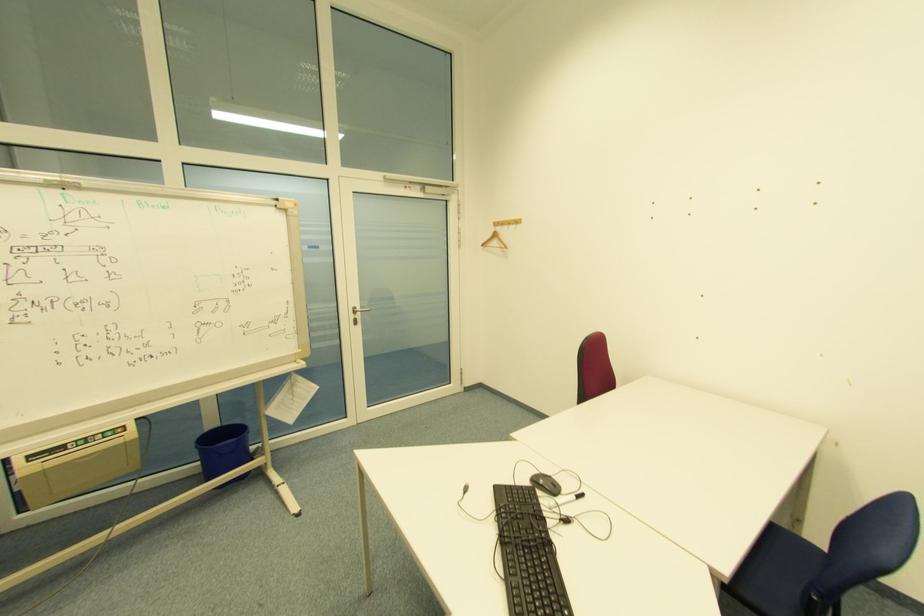
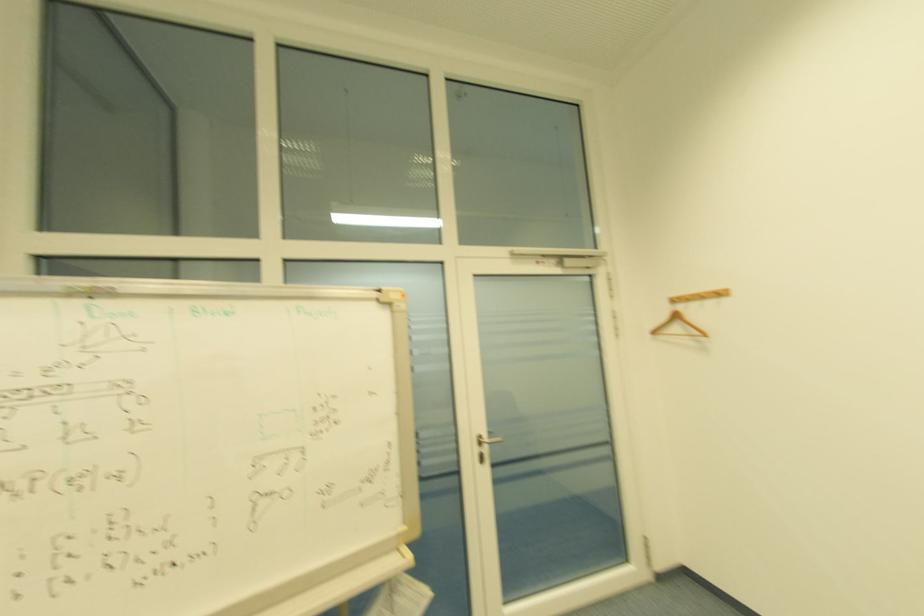
How did the camera likely rotate?

The rotation direction of the camera is left-up.